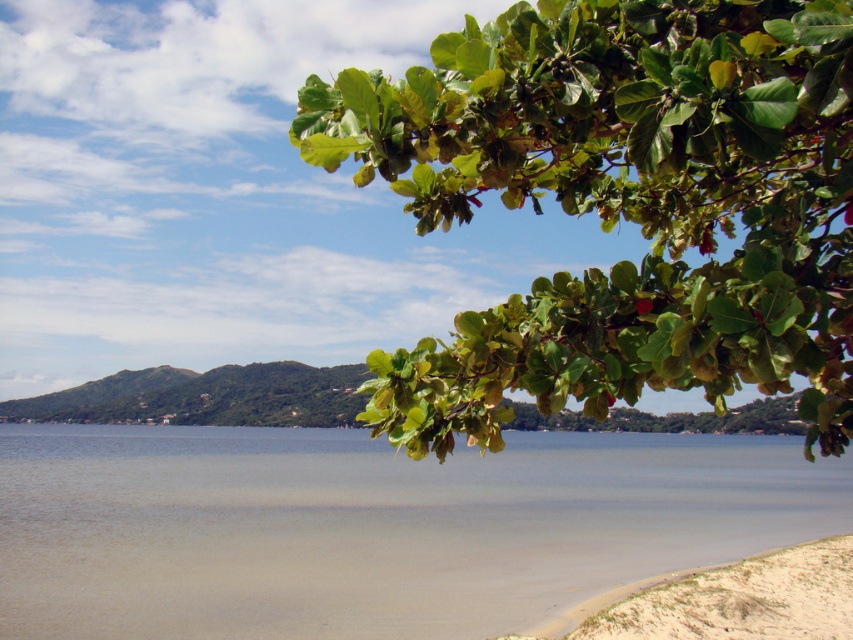
Question: Is green leafy branch at upper right further to the viewer compared to white sandy beach at lower right?

Choices:
 (A) yes
 (B) no

Answer: (B)

Question: Which point is farther to the camera?

Choices:
 (A) white sandy beach at lower right
 (B) green leafy branch at upper right
 (C) clear water at lower left

Answer: (C)

Question: Does green leafy branch at upper right come in front of white sandy beach at lower right?

Choices:
 (A) no
 (B) yes

Answer: (B)

Question: Is clear water at lower left below white sandy beach at lower right?

Choices:
 (A) no
 (B) yes

Answer: (A)

Question: Among these points, which one is farthest from the camera?

Choices:
 (A) (633, 486)
 (B) (393, 108)

Answer: (A)

Question: Which object is the farthest from the clear water at lower left?

Choices:
 (A) white sandy beach at lower right
 (B) green leafy branch at upper right

Answer: (B)